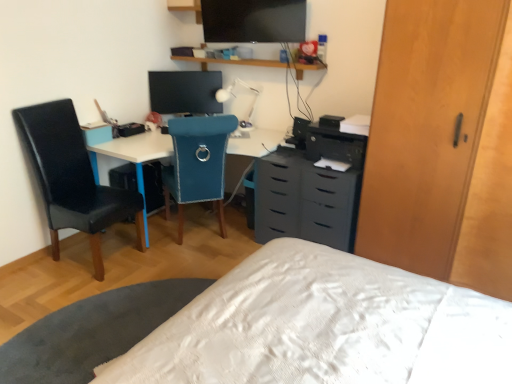
Question: Can you confirm if white plastic table lamp at center is bigger than matte gray chest of drawers at center?

Choices:
 (A) yes
 (B) no

Answer: (B)

Question: From a real-world perspective, is white plastic table lamp at center below matte gray chest of drawers at center?

Choices:
 (A) yes
 (B) no

Answer: (B)

Question: Can you see white plastic table lamp at center touching matte gray chest of drawers at center?

Choices:
 (A) yes
 (B) no

Answer: (B)

Question: Is white plastic table lamp at center smaller than matte gray chest of drawers at center?

Choices:
 (A) yes
 (B) no

Answer: (A)

Question: Is white plastic table lamp at center completely or partially outside of matte gray chest of drawers at center?

Choices:
 (A) no
 (B) yes

Answer: (B)

Question: From the image's perspective, is white plastic table lamp at center over matte gray chest of drawers at center?

Choices:
 (A) yes
 (B) no

Answer: (A)

Question: Is wooden shelf at upper center taller than white plastic desk at center?

Choices:
 (A) no
 (B) yes

Answer: (A)

Question: Is white plastic desk at center inside wooden shelf at upper center?

Choices:
 (A) no
 (B) yes

Answer: (A)

Question: Is wooden shelf at upper center not near white plastic desk at center?

Choices:
 (A) no
 (B) yes

Answer: (B)

Question: Is wooden shelf at upper center oriented towards white plastic desk at center?

Choices:
 (A) yes
 (B) no

Answer: (B)

Question: Does wooden shelf at upper center have a smaller size compared to white plastic desk at center?

Choices:
 (A) yes
 (B) no

Answer: (A)

Question: Is wooden shelf at upper center bigger than white plastic desk at center?

Choices:
 (A) yes
 (B) no

Answer: (B)

Question: Does black leather chair at left, placed as the second chair when sorted from right to left, have a smaller size compared to white plastic desk at center?

Choices:
 (A) yes
 (B) no

Answer: (A)